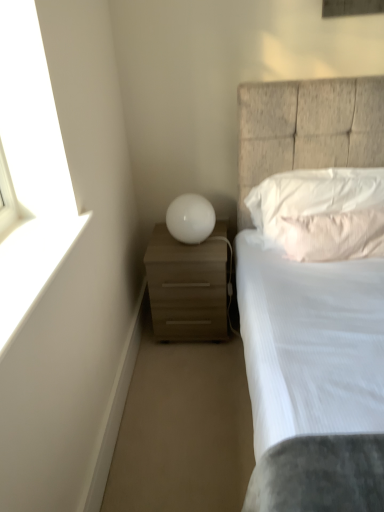
Question: Looking at their shapes, would you say white matte window sill at upper left is wider or thinner than white soft pillow at upper right, the 1th pillow when ordered from top to bottom?

Choices:
 (A) thin
 (B) wide

Answer: (B)

Question: Would you say white matte window sill at upper left is to the left or to the right of white soft pillow at upper right, the 2th pillow ordered from the bottom, in the picture?

Choices:
 (A) right
 (B) left

Answer: (B)

Question: Which object is the closest to the matte wood nightstand at lower left?

Choices:
 (A) white matte window sill at upper left
 (B) pink textured pillow at upper right, which appears as the first pillow when ordered from the bottom
 (C) white glossy sphere at center
 (D) white textured bed at center
 (E) white soft pillow at upper right, the 1th pillow when ordered from top to bottom

Answer: (C)

Question: Estimate the real-world distances between objects in this image. Which object is farther from the white soft pillow at upper right, the 1th pillow when ordered from top to bottom?

Choices:
 (A) white glossy sphere at center
 (B) white matte window sill at upper left
 (C) matte wood nightstand at lower left
 (D) pink textured pillow at upper right, which appears as the first pillow when ordered from the bottom
 (E) white textured bed at center

Answer: (B)